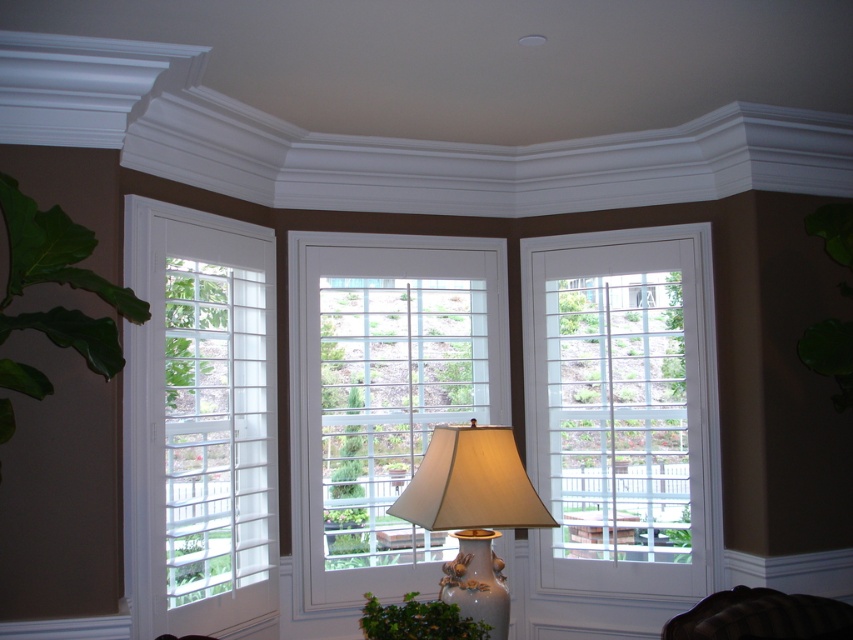
You are standing in the room and want to place a new decorative item between the white smooth crown molding at upper center and the green leafy plant at left. Based on their positions, where should you place the new item?

The white smooth crown molding at upper center is located above the green leafy plant at left, so you should place the new item between them in the vertical space between the crown molding and the plant.

You are an interior designer assessing the room layout. You notice the white smooth crown molding at upper center and the green leafy plant at left. Which object occupies more space in terms of size?

The white smooth crown molding at upper center has a larger size compared to the green leafy plant at left, so it occupies more space in terms of size.